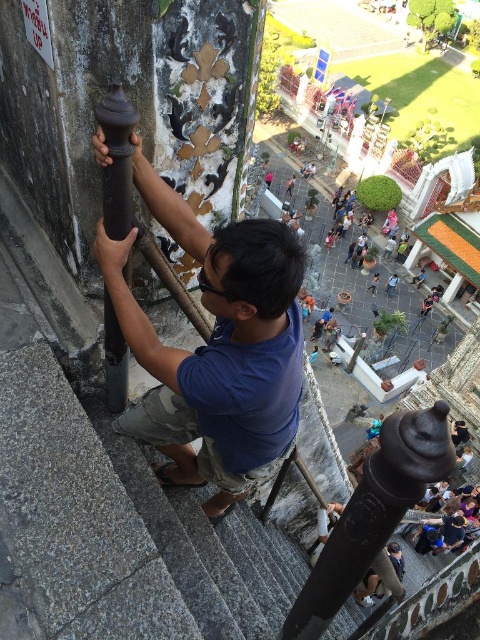
You are a tourist standing at the bottom of the staircase in the image. You want to take a photo of the matte black pole at center and the dark brown polished wood at left. Which object should you adjust your camera angle to capture first based on their heights?

The matte black pole at center is shorter than the dark brown polished wood at left, so you should adjust your camera angle to capture the matte black pole at center first since it is lower in height.

You are standing at the top of the staircase and want to place a small potted plant between the matte black pole at center and the dark brown polished wood at left. Can you do this without moving either object?

The dark brown polished wood at left is behind the matte black pole at center, so there is no space between them for placing a potted plant.

You are a tourist standing at the base of the staircase. You see the matte black pole at center and the dark brown polished wood at left. Which object is closer to you?

The matte black pole at center is closer to you because it is positioned under the dark brown polished wood at left, indicating it is in front of the wood.